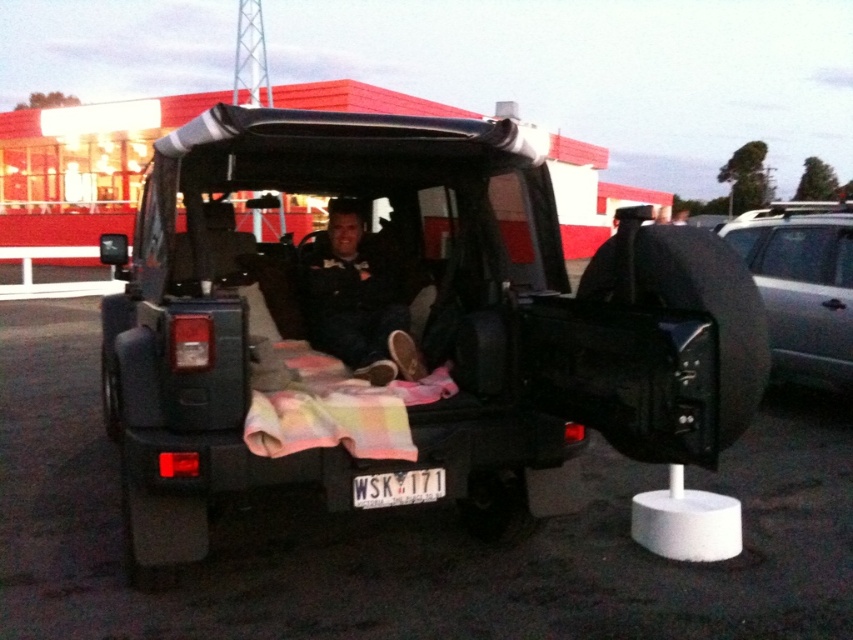
You are trying to determine the parking space size needed for the silver metallic suv at right. You know that the white plastic license plate at center is 12 inches wide. Can the parking space accommodate the suv if it must be at least twice as wide as the license plate?

The silver metallic suv at right is wider than the white plastic license plate at center. Since the license plate is 12 inches wide, the suv is wider than 12 inches. However, the parking space must be at least twice the license plate width, which would be 24 inches. Since the suv is wider than 12 inches but we don

You are a delivery person who needs to place a small package on the tailgate of the Jeep Wrangler. The package must be placed where the matte black jacket at center is currently located. Is there enough space for the package if the jacket is moved?

The matte black jacket at center is located at point (358, 300). Since the jacket is at the center, there should be enough space on the tailgate to move it and place the package there.